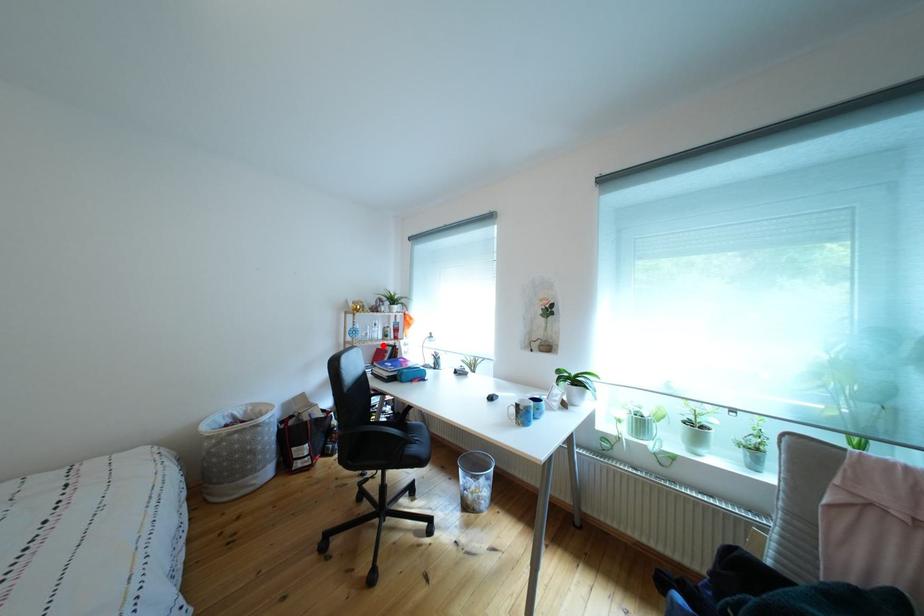
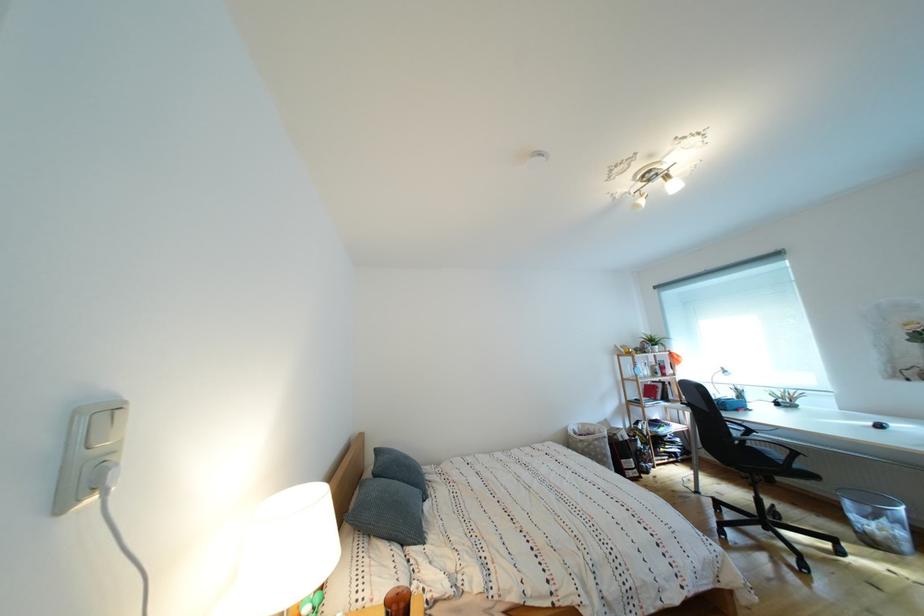
Find the pixel in the second image that matches the highlighted location in the first image.

(657, 383)